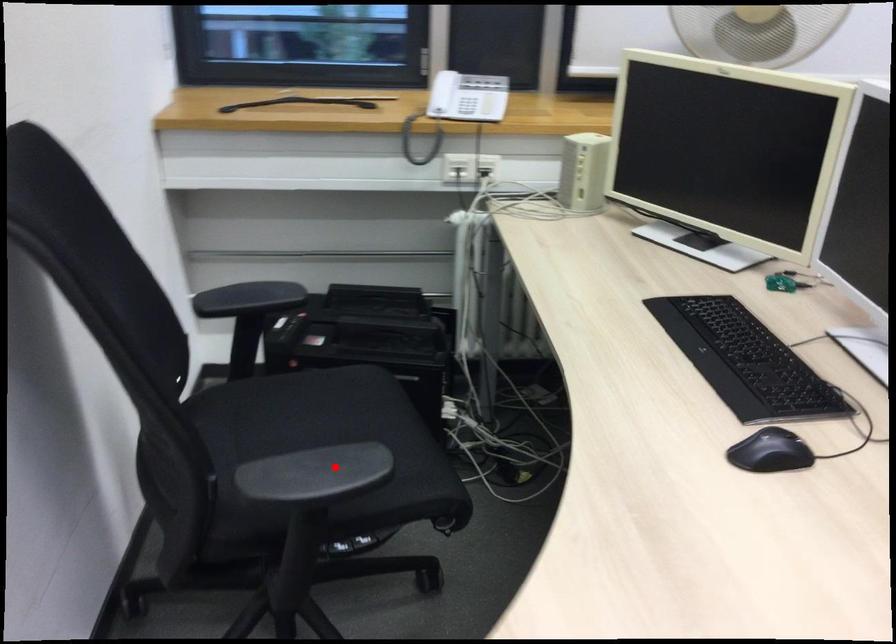
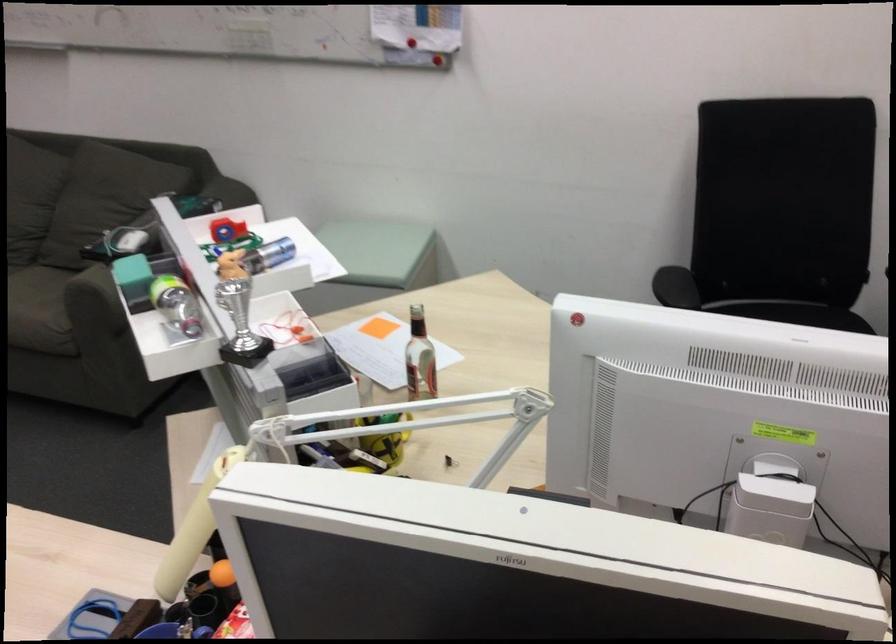
Where in the second image is the point corresponding to the highlighted location from the first image?

(675, 287)